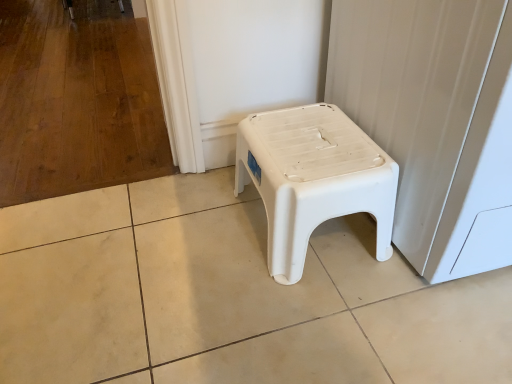
Identify the location of vacant space underneath white plastic stool at center (from a real-world perspective). Image resolution: width=512 pixels, height=384 pixels. (323, 237).